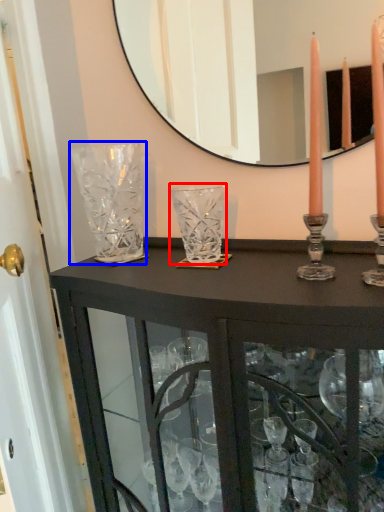
Question: Which object is closer to the camera taking this photo, glass vase (highlighted by a red box) or glass vase (highlighted by a blue box)?

Choices:
 (A) glass vase
 (B) glass vase

Answer: (A)